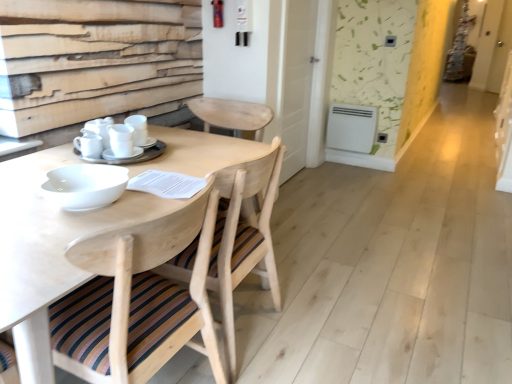
Question: Is the depth of white matte cups at center, which ranks as the 3th tableware in left-to-right order, less than that of white plastic radiator at center?

Choices:
 (A) yes
 (B) no

Answer: (A)

Question: Does white matte cups at center, placed as the 1th tableware when sorted from right to left, appear on the left side of white plastic radiator at center?

Choices:
 (A) no
 (B) yes

Answer: (B)

Question: Can you confirm if white matte cups at center, placed as the 1th tableware when sorted from right to left, is smaller than white plastic radiator at center?

Choices:
 (A) yes
 (B) no

Answer: (A)

Question: Can you confirm if white matte cups at center, placed as the 1th tableware when sorted from right to left, is shorter than white plastic radiator at center?

Choices:
 (A) yes
 (B) no

Answer: (A)

Question: From a real-world perspective, is white matte cups at center, placed as the 1th tableware when sorted from right to left, over white plastic radiator at center?

Choices:
 (A) no
 (B) yes

Answer: (B)

Question: Can you confirm if white matte cups at center, placed as the 1th tableware when sorted from right to left, is bigger than white plastic radiator at center?

Choices:
 (A) yes
 (B) no

Answer: (B)

Question: Can you confirm if white glossy screen door at upper right is thinner than white plastic radiator at center?

Choices:
 (A) no
 (B) yes

Answer: (B)

Question: Can you confirm if white glossy screen door at upper right is taller than white plastic radiator at center?

Choices:
 (A) no
 (B) yes

Answer: (B)

Question: Is white glossy screen door at upper right next to white plastic radiator at center and touching it?

Choices:
 (A) yes
 (B) no

Answer: (B)

Question: Considering the relative sizes of white glossy screen door at upper right and white plastic radiator at center in the image provided, is white glossy screen door at upper right bigger than white plastic radiator at center?

Choices:
 (A) no
 (B) yes

Answer: (B)

Question: Can you confirm if white glossy screen door at upper right is wider than white plastic radiator at center?

Choices:
 (A) no
 (B) yes

Answer: (A)

Question: From a real-world perspective, is white glossy screen door at upper right under white plastic radiator at center?

Choices:
 (A) no
 (B) yes

Answer: (A)

Question: From the image's perspective, is white matte cups at center, placed as the second tableware when sorted from right to left, on natural wood chair at center, which is the first chair from back to front?

Choices:
 (A) yes
 (B) no

Answer: (A)